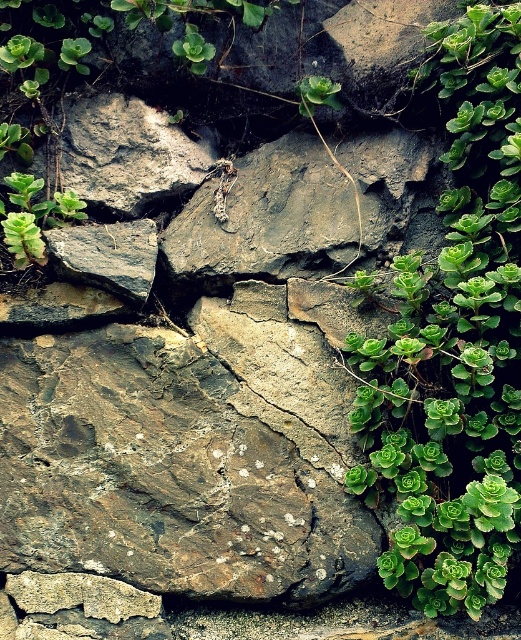
Which is above, rusty stone wall at center or green succulent at right?

green succulent at right

Is rusty stone wall at center above green succulent at right?

No.

Between point (134, 518) and point (508, 177), which one is positioned behind?

Positioned behind is point (134, 518).

Where is `rusty stone wall at center`? This screenshot has height=640, width=521. rusty stone wall at center is located at coordinates (166, 474).